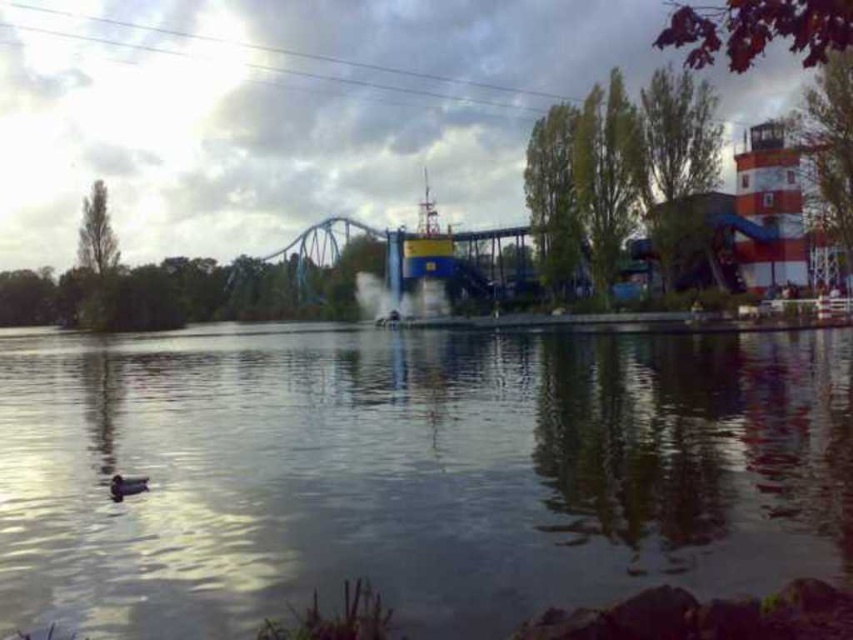
You are planning to place a small floating platform in the image. The platform requires a space wider than the brown matte duck at lower left. Can the smooth water at center provide enough width for this platform?

The smooth water at center is wider than the brown matte duck at lower left, so yes, the smooth water at center can provide enough width for the platform.

You are standing at the edge of the water and see the brown matte duck at lower left and the smooth water at center. Which object is closer to your right side?

The smooth water at center is to the right of the brown matte duck at lower left, so the smooth water at center is closer to your right side.

You are standing on the edge of the smooth water at center and want to reach the brown matte duck at lower left. The park requires that you maintain a minimum distance of 200 feet from all waterfowl for safety. Can you safely approach the duck without violating this rule?

The distance between the smooth water at center and the brown matte duck at lower left is 237.14 feet, which exceeds the required 200 feet minimum distance. Therefore, you can safely approach the duck without violating the safety rule.